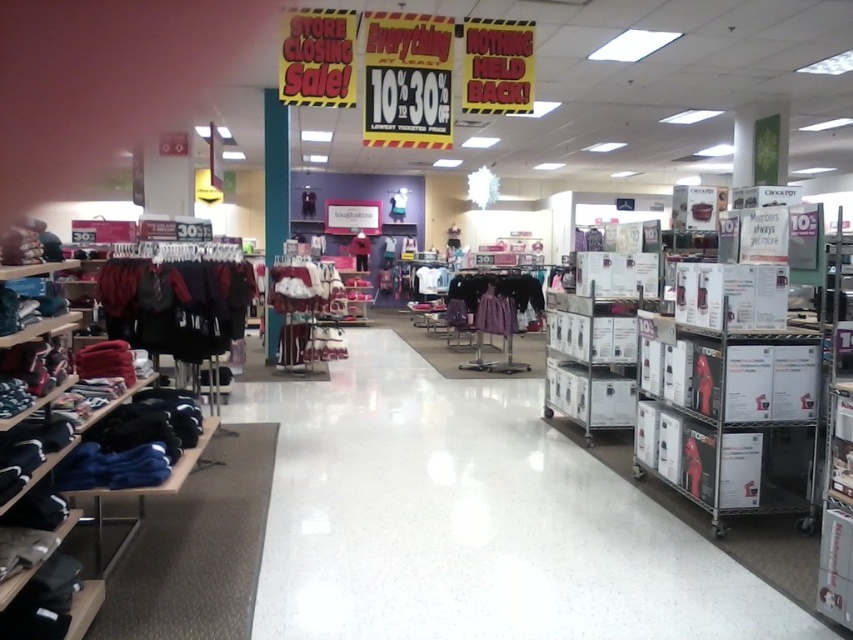
You are a customer in the store and want to reach the velvet maroon dress at center. There is a dark red fabric shirt at left blocking your path. Can you walk through the space between them?

The dark red fabric shirt at left is much taller than the velvet maroon dress at center, so the space between them may be too narrow for you to walk through comfortably. Consider moving around the sides instead.

You are a customer in the store and want to know which item is shorter between the dark blue fabric pants at left and the purple satin dress at center. Which one is shorter?

The dark blue fabric pants at left is not as tall as the purple satin dress at center, so the dark blue fabric pants at left is shorter.

Where is the velvet maroon dress at center located in the image?

The velvet maroon dress at center is located at point (305, 288).